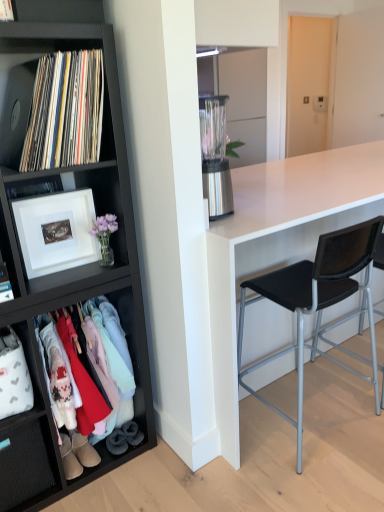
Question: Does black mesh chair at right, the second chair viewed from the right, lie behind velvet grey boot at lower left, which is counted as the second shoe, starting from the right?

Choices:
 (A) yes
 (B) no

Answer: (B)

Question: Is black mesh chair at right, which is the 1th chair in left-to-right order, to the left of velvet grey boot at lower left, the 1th shoe from the left, from the viewer's perspective?

Choices:
 (A) yes
 (B) no

Answer: (B)

Question: Is black mesh chair at right, the second chair viewed from the right, outside of velvet grey boot at lower left, which is counted as the second shoe, starting from the right?

Choices:
 (A) no
 (B) yes

Answer: (B)

Question: Is black mesh chair at right, which is the 1th chair in left-to-right order, aimed at velvet grey boot at lower left, which is counted as the second shoe, starting from the right?

Choices:
 (A) yes
 (B) no

Answer: (B)

Question: Is the depth of black mesh chair at right, the second chair viewed from the right, less than that of velvet grey boot at lower left, the 1th shoe from the left?

Choices:
 (A) yes
 (B) no

Answer: (A)

Question: Is black mesh chair at right, the second chair viewed from the right, not near velvet grey boot at lower left, which is counted as the second shoe, starting from the right?

Choices:
 (A) no
 (B) yes

Answer: (A)

Question: Does matte black clothing rack at lower left have a lesser height compared to leather boot at lower left, which appears as the second footwear when viewed from the right?

Choices:
 (A) no
 (B) yes

Answer: (A)

Question: Is matte black clothing rack at lower left wider than leather boot at lower left, which appears as the second footwear when viewed from the right?

Choices:
 (A) no
 (B) yes

Answer: (B)

Question: Considering the relative positions of matte black clothing rack at lower left and leather boot at lower left, which is the first footwear from left to right, in the image provided, is matte black clothing rack at lower left to the right of leather boot at lower left, which is the first footwear from left to right, from the viewer's perspective?

Choices:
 (A) no
 (B) yes

Answer: (B)

Question: From the image's perspective, is matte black clothing rack at lower left beneath leather boot at lower left, which appears as the second footwear when viewed from the right?

Choices:
 (A) yes
 (B) no

Answer: (B)

Question: Can you confirm if matte black clothing rack at lower left is smaller than leather boot at lower left, which is the first footwear from left to right?

Choices:
 (A) yes
 (B) no

Answer: (B)

Question: Is leather boot at lower left, which is the first footwear from left to right, completely or partially inside matte black clothing rack at lower left?

Choices:
 (A) no
 (B) yes

Answer: (B)

Question: Is white fabric drawer at lower left at the right side of leather boot at lower left, which is the first footwear from left to right?

Choices:
 (A) yes
 (B) no

Answer: (B)